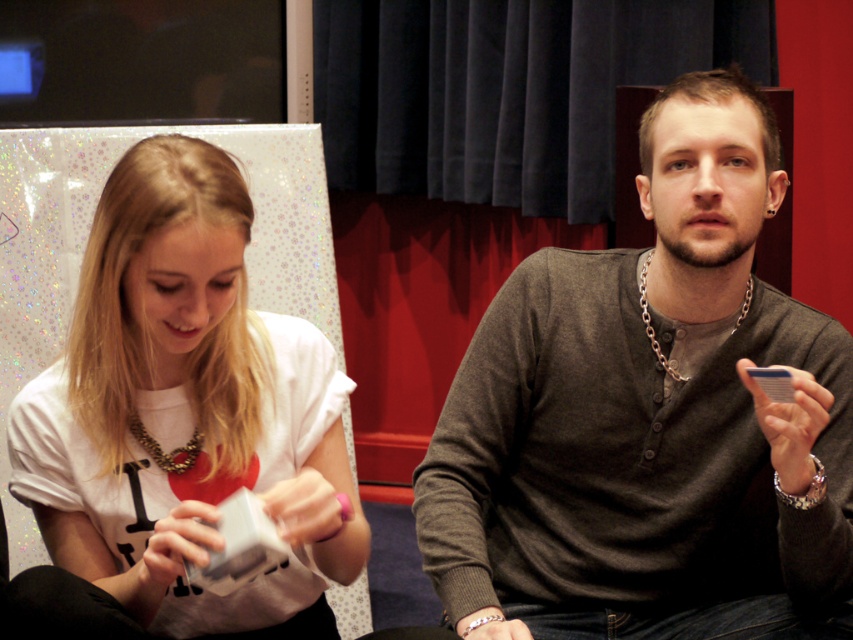
You are standing in front of the image and want to touch the point that is closer to you between the two points labeled as point (141, 428) and point (641, 280). Which point should you choose?

You should choose point (141, 428) because it is closer to the viewer than point (641, 280).

You are a photographer standing at the camera position. You want to take a photo of the scene but need to ensure that the point at coordinates point (x=798, y=426) is in focus. Given that your camera has a depth of field that can sharply focus objects within a range of 0.5 meters, will the point be in focus?

The point at coordinates point (x=798, y=426) is 1.02 meters away from the camera. Since the depth of field can focus within 0.5 meters, the point is outside the focus range and will not be in focus.